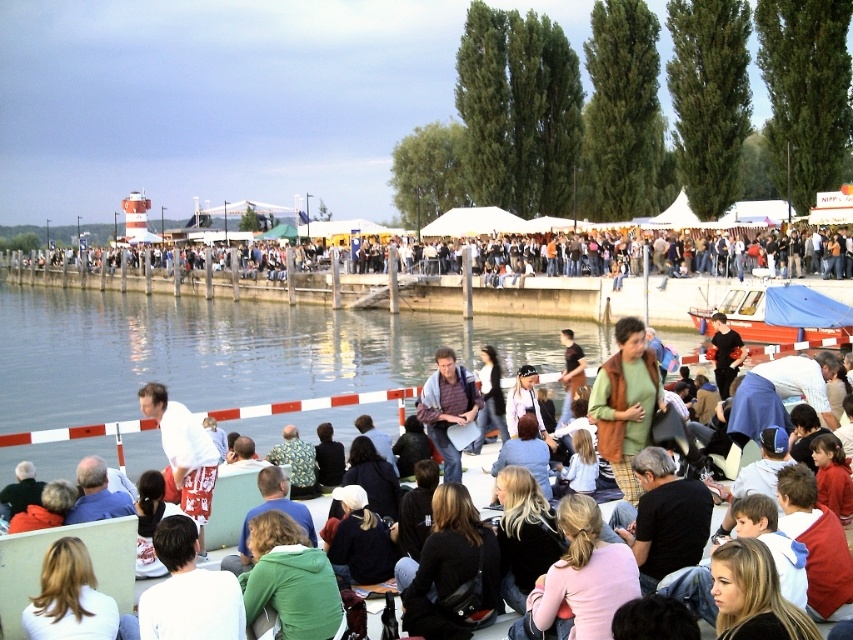
Question: Can you confirm if green fabric jacket at center is wider than red plastic boat at center?

Choices:
 (A) yes
 (B) no

Answer: (A)

Question: Which of the following is the farthest from the observer?

Choices:
 (A) green wool sweater at center
 (B) dark brown leather jacket at center
 (C) blonde hair at lower left

Answer: (A)

Question: Which object is positioned closest to the white cotton shirt at lower left?

Choices:
 (A) green fabric jacket at center
 (B) white tent at center
 (C) white cotton shirt at center
 (D) pink fabric shirt at lower center

Answer: (C)

Question: Which point is farther to the camera?

Choices:
 (A) pink fabric shirt at lower center
 (B) white cotton shirt at lower left
 (C) green fleece jacket at lower center
 (D) blonde hair at lower left

Answer: (C)

Question: Can you confirm if green wool sweater at center is smaller than red plastic boat at center?

Choices:
 (A) no
 (B) yes

Answer: (A)

Question: From the image, what is the correct spatial relationship of dark brown leather jacket at center in relation to white cotton shirt at center?

Choices:
 (A) above
 (B) below

Answer: (B)